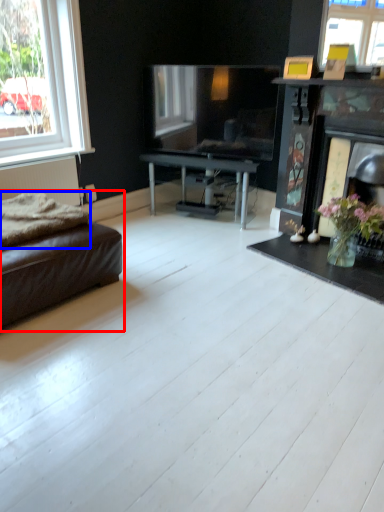
Question: Which object appears farthest to the camera in this image, studio couch (highlighted by a red box) or blanket (highlighted by a blue box)?

Choices:
 (A) studio couch
 (B) blanket

Answer: (B)